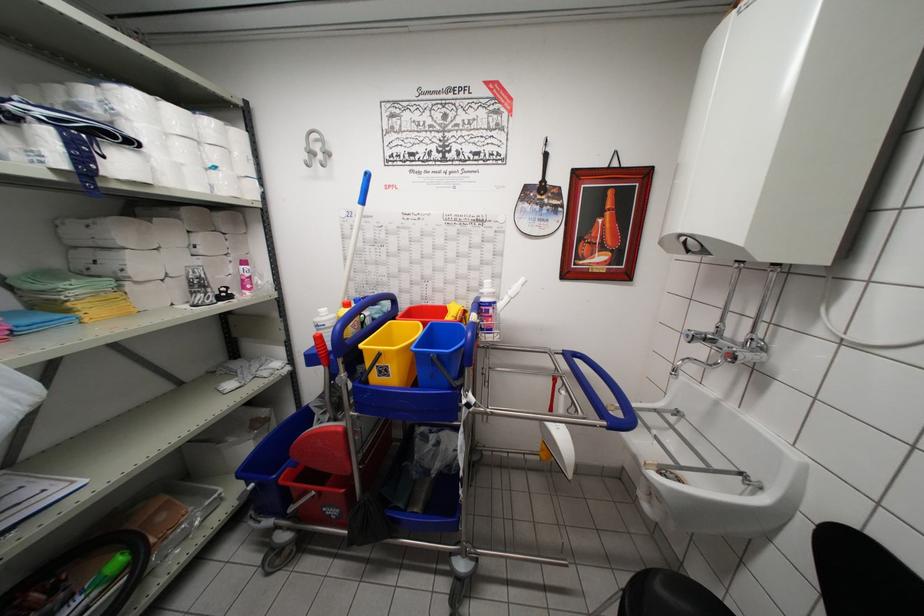
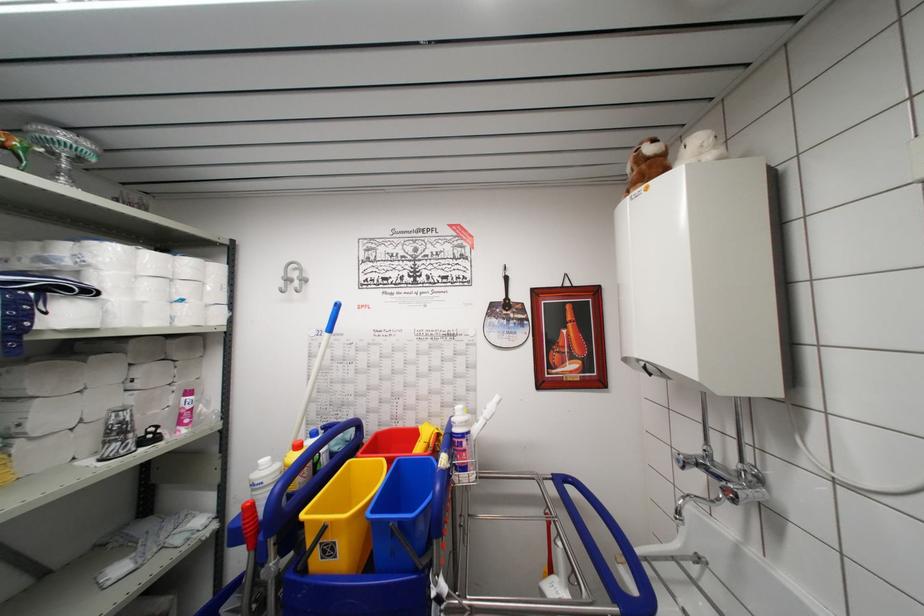
The point at (x=545, y=197) is marked in the first image. Where is the corresponding point in the second image?

(511, 313)